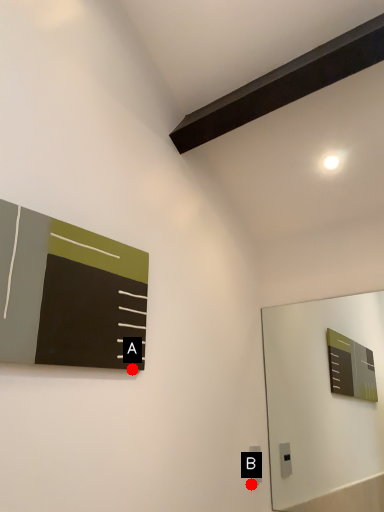
Question: Two points are circled on the image, labeled by A and B beside each circle. Among these points, which one is nearest to the camera?

Choices:
 (A) A is closer
 (B) B is closer

Answer: (A)